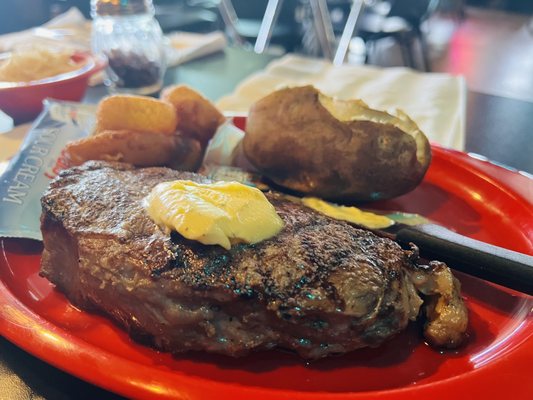
Locate an element on the screen. bowl is located at coordinates (31, 104).